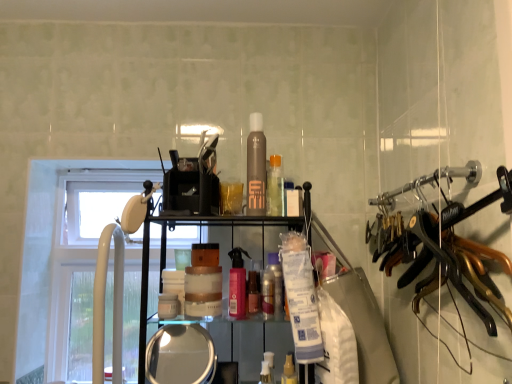
Question: Considering the relative sizes of white plastic window at left and clear glass mirror at lower center in the image provided, is white plastic window at left taller than clear glass mirror at lower center?

Choices:
 (A) yes
 (B) no

Answer: (A)

Question: Is white plastic window at left not near clear glass mirror at lower center?

Choices:
 (A) yes
 (B) no

Answer: (B)

Question: Is clear glass mirror at lower center completely or partially inside white plastic window at left?

Choices:
 (A) yes
 (B) no

Answer: (B)

Question: Considering the relative positions of white plastic window at left and clear glass mirror at lower center in the image provided, is white plastic window at left behind clear glass mirror at lower center?

Choices:
 (A) no
 (B) yes

Answer: (B)

Question: Is white plastic window at left directly adjacent to clear glass mirror at lower center?

Choices:
 (A) yes
 (B) no

Answer: (B)

Question: Is point (287, 365) closer or farther from the camera than point (234, 294)?

Choices:
 (A) farther
 (B) closer

Answer: (A)

Question: In terms of size, does translucent plastic spray bottle at center, which is the second toiletry from right to left, appear bigger or smaller than pink matte spray bottle at center, the 2th toiletry viewed from the left?

Choices:
 (A) big
 (B) small

Answer: (B)

Question: In terms of height, does translucent plastic spray bottle at center, which is the second toiletry from right to left, look taller or shorter compared to pink matte spray bottle at center, the 2th toiletry viewed from the left?

Choices:
 (A) short
 (B) tall

Answer: (A)

Question: Relative to pink matte spray bottle at center, which is the sixth toiletry from right to left, is translucent plastic spray bottle at center, which is the second toiletry from right to left, in front or behind?

Choices:
 (A) behind
 (B) front

Answer: (B)

Question: In terms of width, does pink matte spray bottle at center, the 2th toiletry viewed from the left, look wider or thinner when compared to clear glass mirror at lower center?

Choices:
 (A) wide
 (B) thin

Answer: (B)

Question: Based on their positions, is pink matte spray bottle at center, the 2th toiletry viewed from the left, located to the left or right of clear glass mirror at lower center?

Choices:
 (A) left
 (B) right

Answer: (B)

Question: Considering the positions of pink matte spray bottle at center, the 2th toiletry viewed from the left, and clear glass mirror at lower center in the image, is pink matte spray bottle at center, the 2th toiletry viewed from the left, taller or shorter than clear glass mirror at lower center?

Choices:
 (A) tall
 (B) short

Answer: (B)

Question: From a real-world perspective, is pink matte spray bottle at center, the 2th toiletry viewed from the left, positioned above or below clear glass mirror at lower center?

Choices:
 (A) below
 (B) above

Answer: (B)

Question: Is white plastic window at left taller or shorter than white plastic faucet at left?

Choices:
 (A) tall
 (B) short

Answer: (A)

Question: Does point click(x=45, y=208) appear closer or farther from the camera than point click(x=121, y=261)?

Choices:
 (A) farther
 (B) closer

Answer: (A)